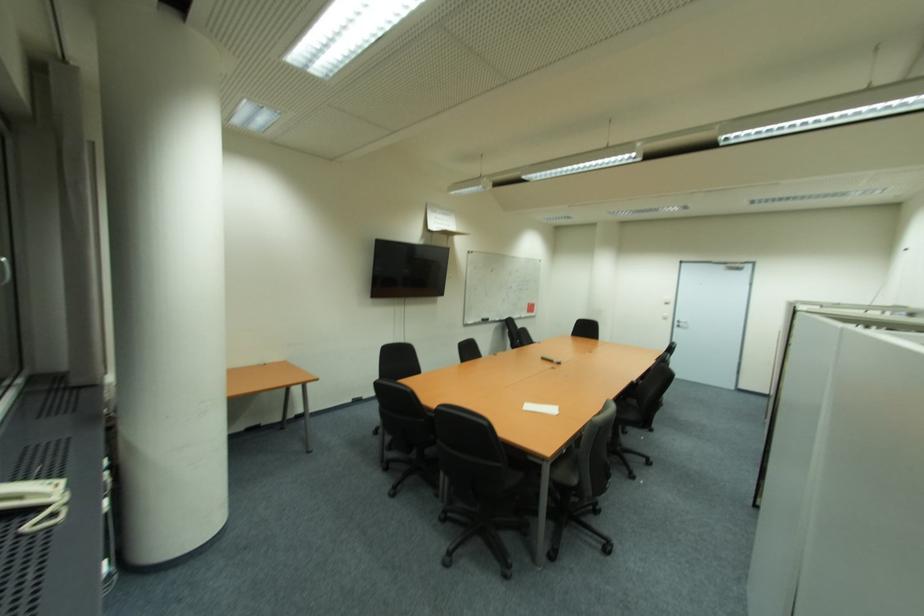
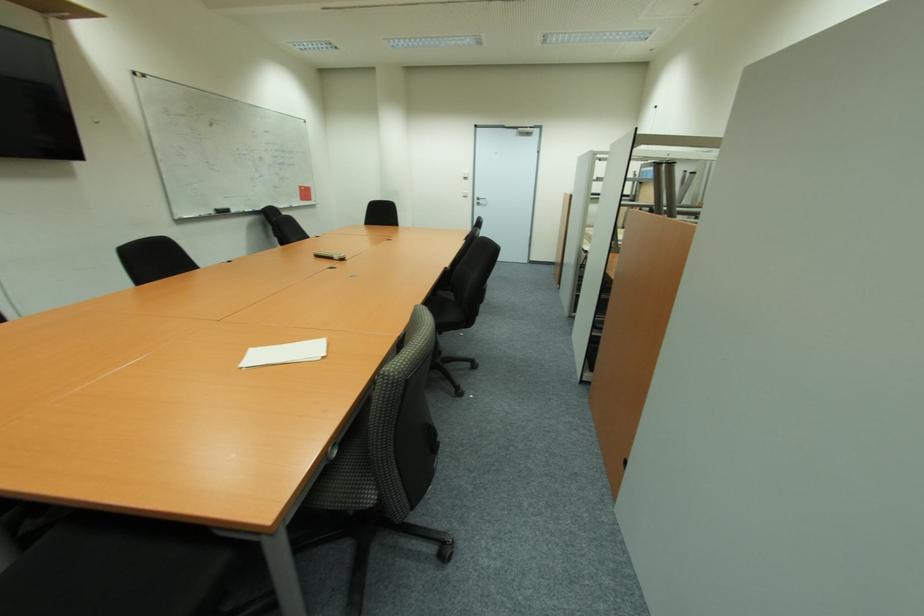
In the second image, find the point that corresponds to (554,362) in the first image.

(334, 259)